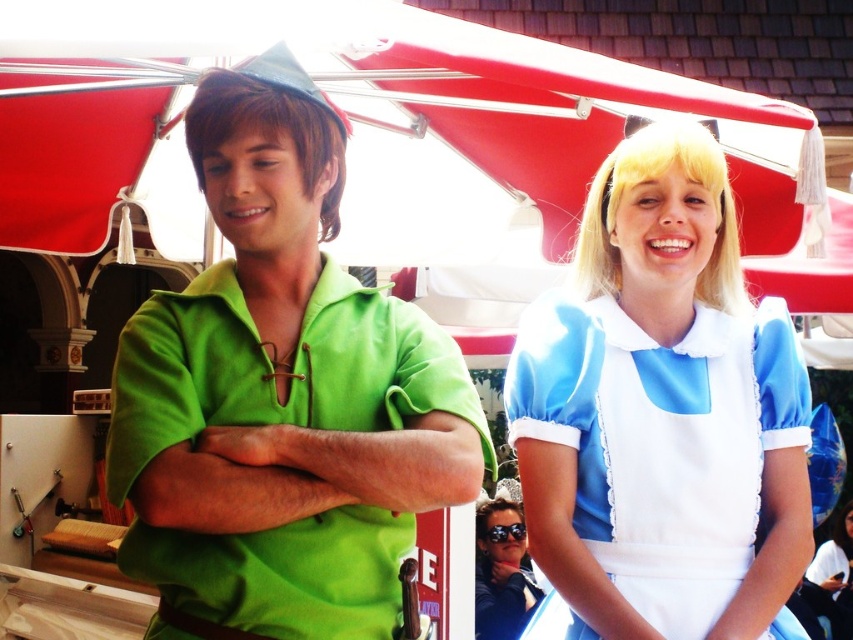
Is point (109, 458) behind point (512, 611)?

That is False.

Is matte blue dress at center to the right of sunglasses at center from the viewer's perspective?

No, matte blue dress at center is not to the right of sunglasses at center.

You are a GUI agent. You are given a task and a screenshot of the screen. Output one action in this format:
    pyautogui.click(x=<x>, y=<y>)
    Task: Click on the matte blue dress at center
    
    Given the screenshot: What is the action you would take?
    pyautogui.click(x=281, y=394)

Can you confirm if matte blue dress at center is positioned above blue satin dress at right?

Yes.

Is matte blue dress at center taller than blue satin dress at right?

Yes, matte blue dress at center is taller than blue satin dress at right.

Does point (329, 625) lie behind point (540, 444)?

No, it is in front of (540, 444).

This screenshot has width=853, height=640. I want to click on matte blue dress at center, so coord(281,394).

Does red fabric umbrella at upper center have a greater width compared to sunglasses at center?

Yes, red fabric umbrella at upper center is wider than sunglasses at center.

In the scene shown: Can you confirm if red fabric umbrella at upper center is thinner than sunglasses at center?

In fact, red fabric umbrella at upper center might be wider than sunglasses at center.

Measure the distance between red fabric umbrella at upper center and camera.

The distance of red fabric umbrella at upper center from camera is 6.49 meters.

Identify the location of red fabric umbrella at upper center. Image resolution: width=853 pixels, height=640 pixels. (387, 140).